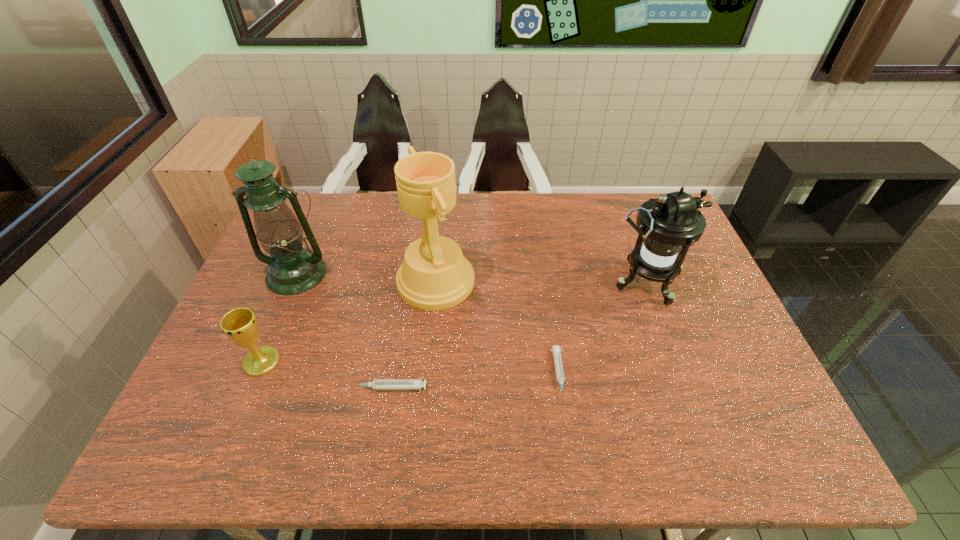
Locate an element on the screen. This screenshot has width=960, height=540. vacant space located at the needle end of the left syringe is located at coordinates (245, 388).

This screenshot has height=540, width=960. What are the coordinates of `vacant point located at the needle end of the left syringe` in the screenshot? It's located at (311, 388).

You are a GUI agent. You are given a task and a screenshot of the screen. Output one action in this format:
    pyautogui.click(x=<x>, y=<y>)
    Task: Click on the vacant area situated on the front of the award
    The image size is (960, 540).
    Given the screenshot: What is the action you would take?
    pyautogui.click(x=426, y=380)

This screenshot has height=540, width=960. In order to click on free space located on the right of the chalice in this screenshot , I will do tap(386, 362).

Where is `vacant space located on the right of the oil lamp`? vacant space located on the right of the oil lamp is located at coordinates (450, 274).

I want to click on vacant region located on the back of the third tallest object, so click(619, 210).

This screenshot has width=960, height=540. Find the location of `chalice situated at the left edge`. chalice situated at the left edge is located at coordinates 240,325.

Where is `oil lamp situated at the left edge`? This screenshot has height=540, width=960. oil lamp situated at the left edge is located at coordinates (292, 269).

Identify the location of object that is positioned at the right edge. (668, 225).

Where is `vacant space at the far edge of the desktop`? This screenshot has width=960, height=540. vacant space at the far edge of the desktop is located at coordinates (503, 234).